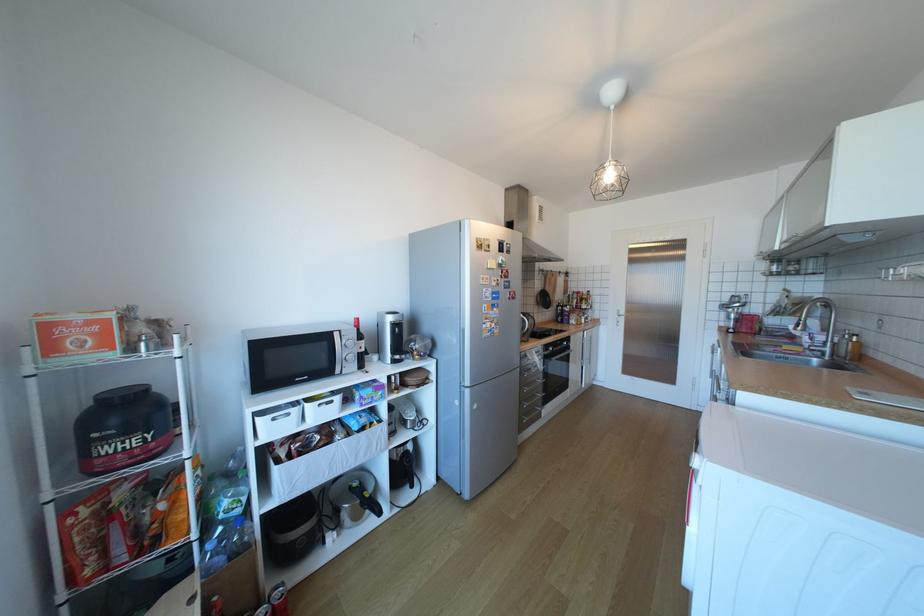
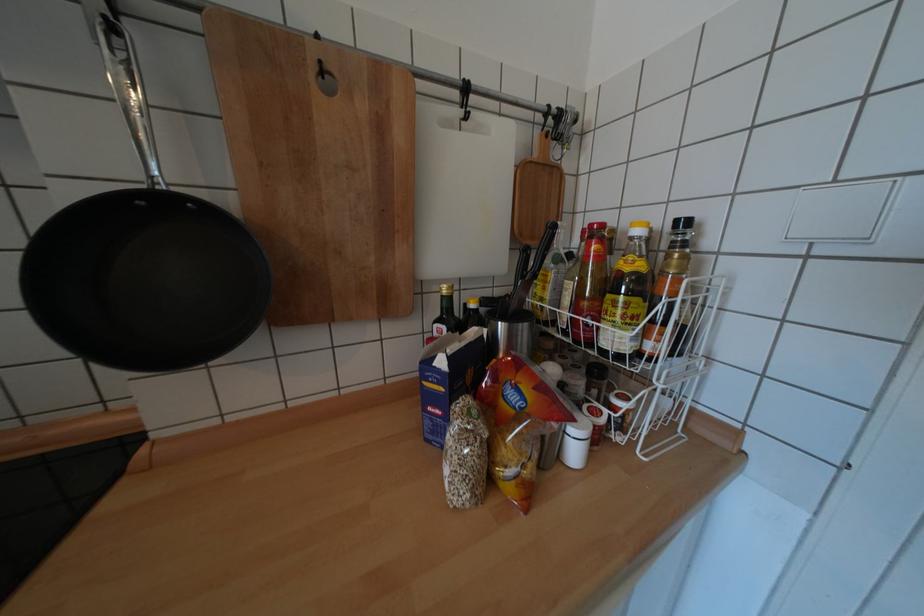
Locate, in the second image, the point that corresponds to the point at 598,292 in the first image.

(694, 224)